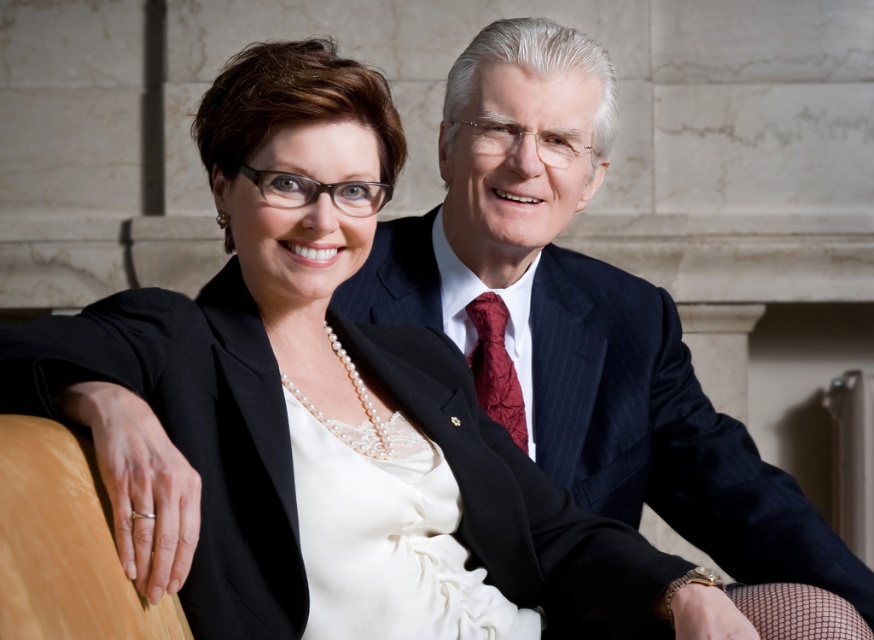
Question: Which object appears farthest from the camera in this image?

Choices:
 (A) shiny burgundy silk tie at center
 (B) dark blue pinstripe suit at upper right
 (C) white satin dress at center

Answer: (A)

Question: Can you confirm if white satin dress at center is smaller than shiny burgundy silk tie at center?

Choices:
 (A) yes
 (B) no

Answer: (B)

Question: Does white satin dress at center have a greater width compared to shiny burgundy silk tie at center?

Choices:
 (A) no
 (B) yes

Answer: (B)

Question: Which object is closer to the camera taking this photo?

Choices:
 (A) dark blue pinstripe suit at upper right
 (B) white satin dress at center

Answer: (B)

Question: Is white satin dress at center behind shiny burgundy silk tie at center?

Choices:
 (A) no
 (B) yes

Answer: (A)

Question: Which point appears farthest from the camera in this image?

Choices:
 (A) (475, 320)
 (B) (571, 396)

Answer: (A)